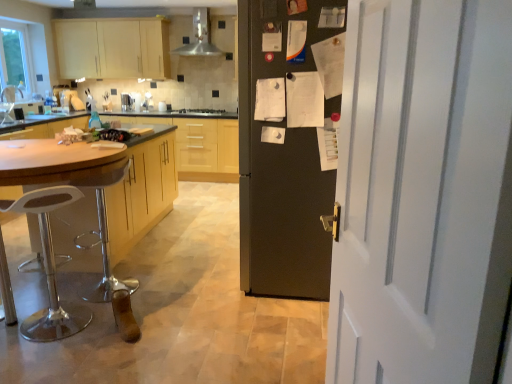
Question: From a real-world perspective, is wooden cabinet at center, which is counted as the first cabinetry, starting from the bottom, under black matte stove at center?

Choices:
 (A) no
 (B) yes

Answer: (B)

Question: From the image's perspective, does wooden cabinet at center, which is the 1th cabinetry from front to back, appear lower than black matte stove at center?

Choices:
 (A) yes
 (B) no

Answer: (A)

Question: Does wooden cabinet at center, acting as the 2th cabinetry starting from the back, appear on the right side of black matte stove at center?

Choices:
 (A) no
 (B) yes

Answer: (A)

Question: Would you say wooden cabinet at center, which is counted as the first cabinetry, starting from the bottom, is outside black matte stove at center?

Choices:
 (A) no
 (B) yes

Answer: (B)

Question: Is wooden cabinet at center, acting as the 2th cabinetry starting from the back, looking in the opposite direction of black matte stove at center?

Choices:
 (A) yes
 (B) no

Answer: (B)

Question: From their relative heights in the image, would you say white painted wood door at right is taller or shorter than white plastic bar stool at left?

Choices:
 (A) short
 (B) tall

Answer: (B)

Question: Considering the positions of white painted wood door at right and white plastic bar stool at left in the image, is white painted wood door at right wider or thinner than white plastic bar stool at left?

Choices:
 (A) thin
 (B) wide

Answer: (A)

Question: Is white painted wood door at right situated inside white plastic bar stool at left or outside?

Choices:
 (A) inside
 (B) outside

Answer: (B)

Question: Is white painted wood door at right in front of or behind white plastic bar stool at left in the image?

Choices:
 (A) front
 (B) behind

Answer: (A)

Question: From their relative heights in the image, would you say white painted wood door at right is taller or shorter than matte black fridge at center?

Choices:
 (A) short
 (B) tall

Answer: (A)

Question: Based on their sizes in the image, would you say white painted wood door at right is bigger or smaller than matte black fridge at center?

Choices:
 (A) big
 (B) small

Answer: (B)

Question: Looking at their shapes, would you say white painted wood door at right is wider or thinner than matte black fridge at center?

Choices:
 (A) wide
 (B) thin

Answer: (B)

Question: Considering the positions of point (397, 157) and point (268, 160), is point (397, 157) closer or farther from the camera than point (268, 160)?

Choices:
 (A) farther
 (B) closer

Answer: (B)

Question: From the image's perspective, is metallic stainless steel range hood at upper center above or below white painted wood door at right?

Choices:
 (A) below
 (B) above

Answer: (B)

Question: From a real-world perspective, is metallic stainless steel range hood at upper center positioned above or below white painted wood door at right?

Choices:
 (A) below
 (B) above

Answer: (B)